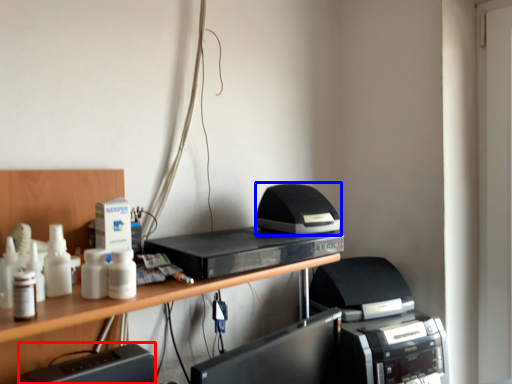
Question: Which point is further to the camera, register (highlighted by a red box) or printer (highlighted by a blue box)?

Choices:
 (A) register
 (B) printer

Answer: (B)